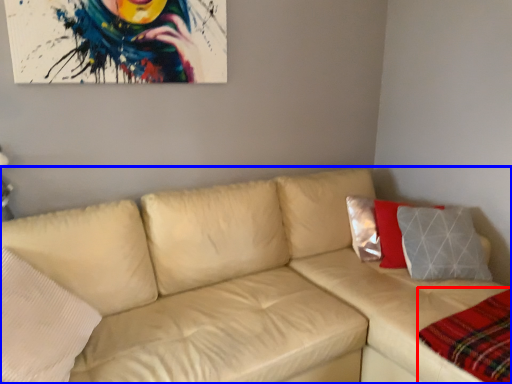
Question: Which object is further to the camera taking this photo, plaid (highlighted by a red box) or studio couch (highlighted by a blue box)?

Choices:
 (A) plaid
 (B) studio couch

Answer: (A)